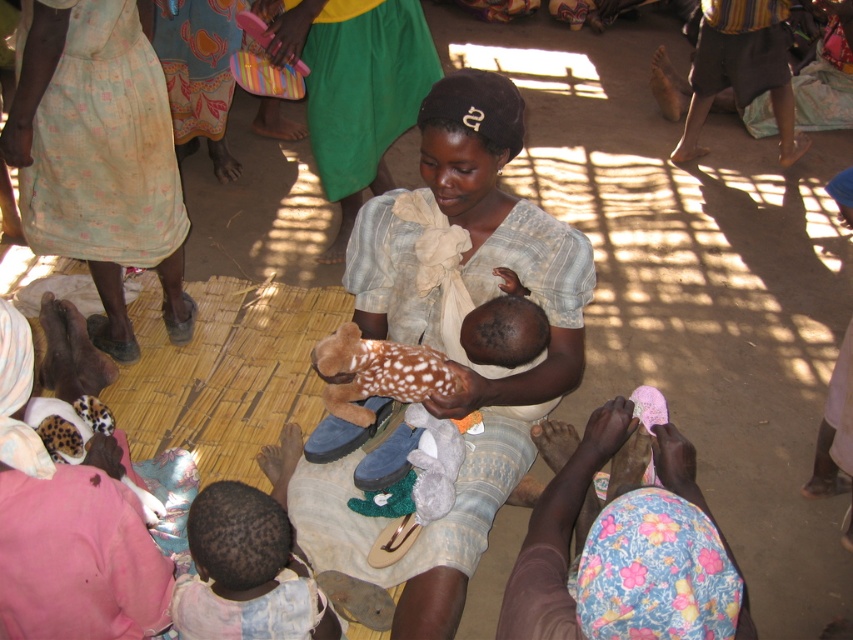
What is the location of the point labeled as (x=625, y=552) in the image?

The point labeled as (x=625, y=552) is located on the fluffy pink cloth at lower center.